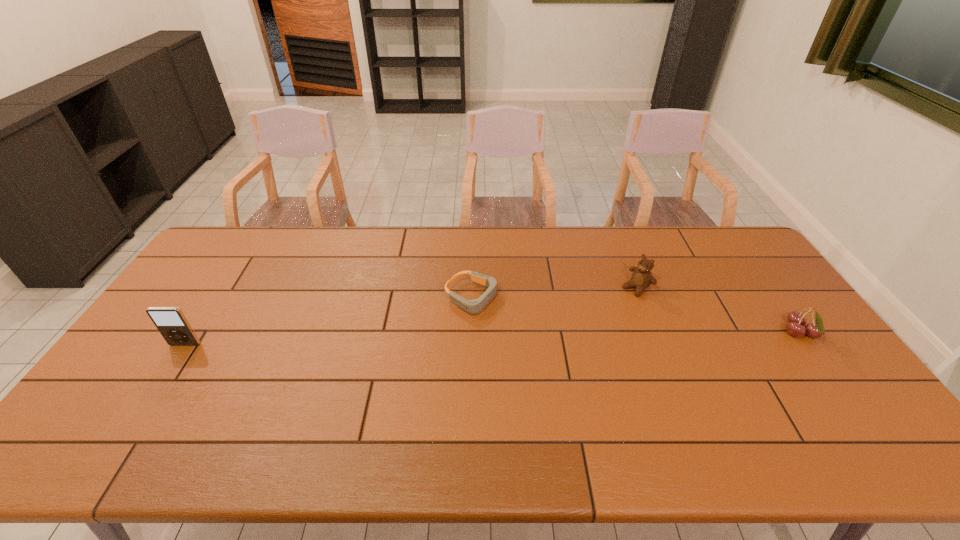
Image resolution: width=960 pixels, height=540 pixels. In order to click on vacant region located 0.230m at the face of the third shortest object in this screenshot , I will do `click(580, 329)`.

Locate an element on the screen. The width and height of the screenshot is (960, 540). free space located at the face of the third shortest object is located at coordinates (604, 312).

The image size is (960, 540). I want to click on free location located 0.240m on the front and back of the shortest object, so click(x=569, y=339).

Locate an element on the screen. This screenshot has height=540, width=960. vacant space located on the front and back of the shortest object is located at coordinates (563, 336).

Find the location of a particular element. blank area located on the front and back of the shortest object is located at coordinates (550, 331).

Where is `object that is at the left edge`? The height and width of the screenshot is (540, 960). object that is at the left edge is located at coordinates [x=170, y=321].

Identify the location of object that is positioned at the right edge. (796, 320).

Locate an element on the screen. The width and height of the screenshot is (960, 540). vacant area at the far edge is located at coordinates (346, 249).

Locate an element on the screen. The image size is (960, 540). blank area at the near edge is located at coordinates click(581, 402).

You are a GUI agent. You are given a task and a screenshot of the screen. Output one action in this format:
    pyautogui.click(x=<x>, y=<y>)
    Task: Click on the vacant area at the left edge of the desktop
    
    Given the screenshot: What is the action you would take?
    (x=151, y=335)